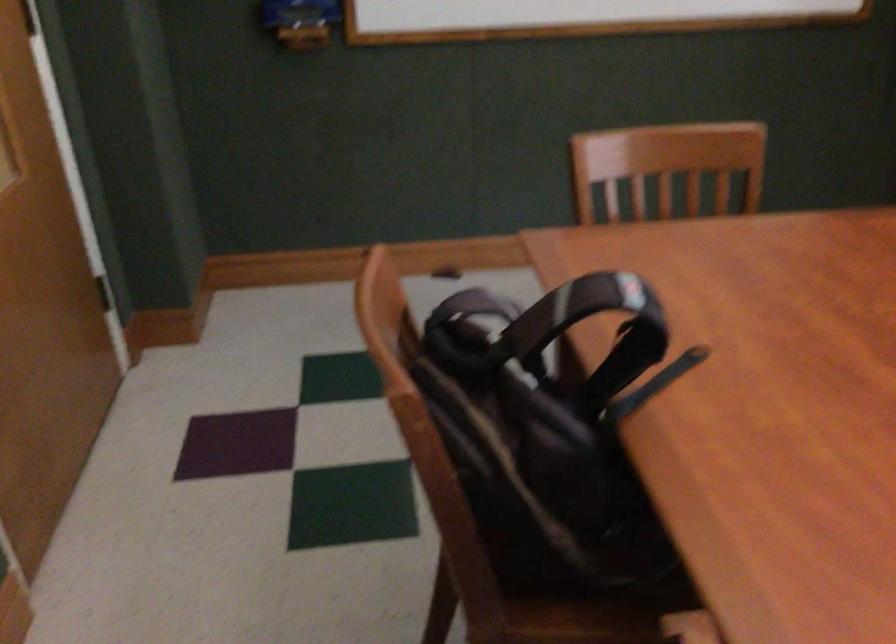
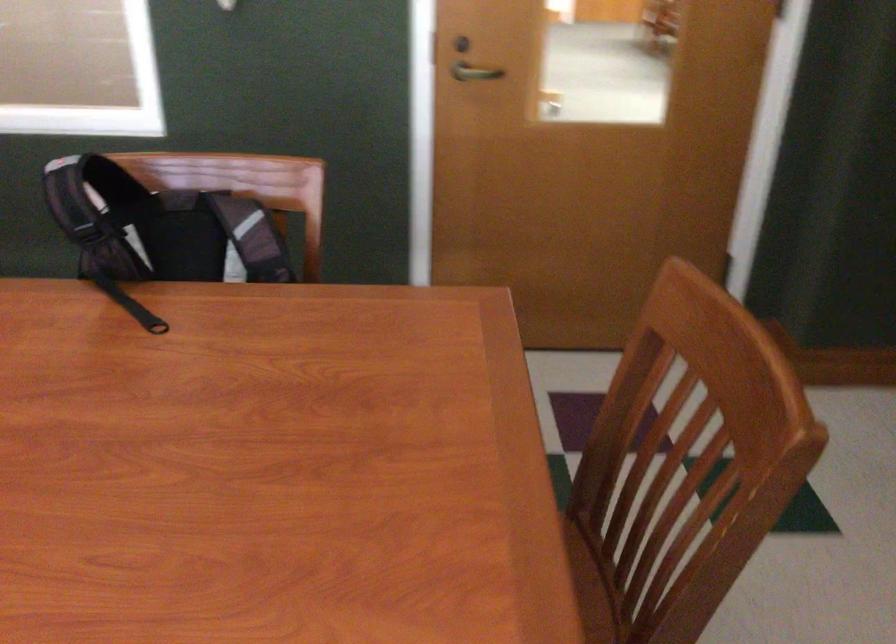
The point at [504,363] is marked in the first image. Where is the corresponding point in the second image?

(159, 228)